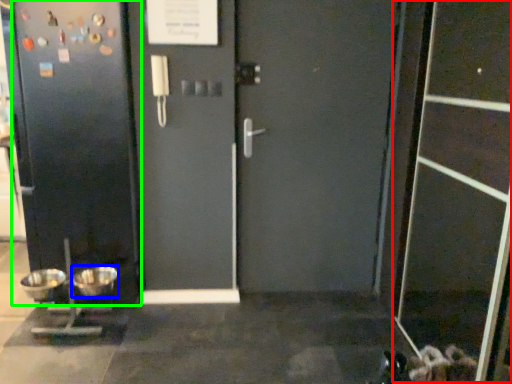
Question: Which object is the farthest from screen door (highlighted by a red box)? Choose among these: mixing bowl (highlighted by a blue box) or door (highlighted by a green box).

Choices:
 (A) mixing bowl
 (B) door

Answer: (A)